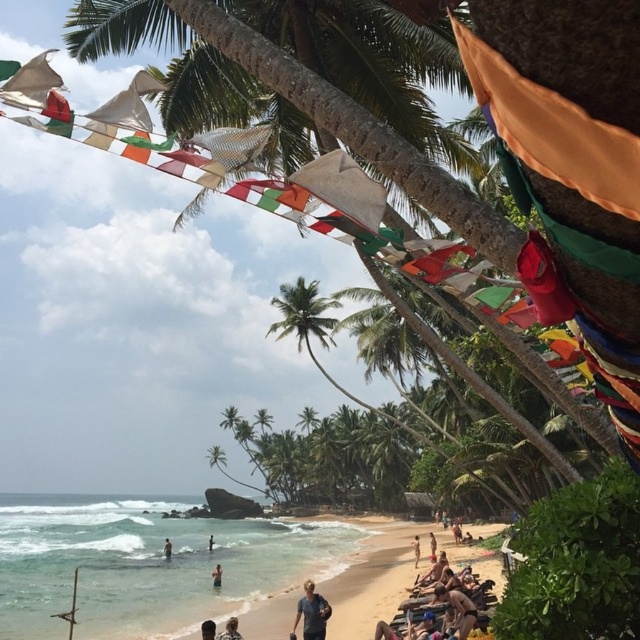
Does tan skin person at lower center have a greater width compared to light brown skin at beach center?

No, tan skin person at lower center is not wider than light brown skin at beach center.

Is tan skin person at lower center positioned behind light brown skin at beach center?

Yes, tan skin person at lower center is further from the viewer.

The height and width of the screenshot is (640, 640). I want to click on tan skin person at lower center, so click(417, 548).

Does brown textured palm tree at center have a lesser width compared to smooth skin person at center?

In fact, brown textured palm tree at center might be wider than smooth skin person at center.

Who is more forward, (390,177) or (212,547)?

Point (390,177) is in front.

This screenshot has width=640, height=640. What are the coordinates of `brown textured palm tree at center` in the screenshot? It's located at (390, 99).

Does tan skin person at lower center lie in front of smooth skin person at lower center?

Yes, tan skin person at lower center is in front of smooth skin person at lower center.

Can you confirm if tan skin person at lower center is positioned to the right of smooth skin person at lower center?

Indeed, tan skin person at lower center is positioned on the right side of smooth skin person at lower center.

Who is more distant from viewer, (x=417, y=552) or (x=170, y=556)?

Positioned behind is point (x=170, y=556).

The image size is (640, 640). I want to click on tan skin person at lower center, so click(x=417, y=548).